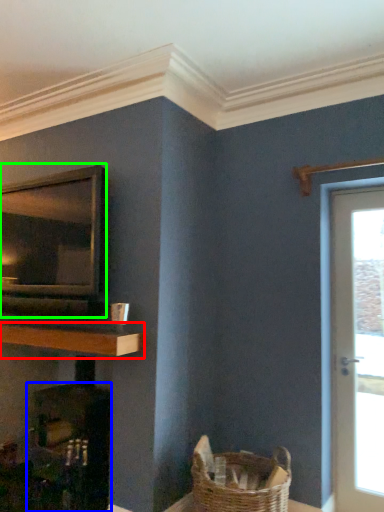
Question: Estimate the real-world distances between objects in this image. Which object is farther from shelf (highlighted by a red box), fireplace (highlighted by a blue box) or appliance (highlighted by a green box)?

Choices:
 (A) fireplace
 (B) appliance

Answer: (A)